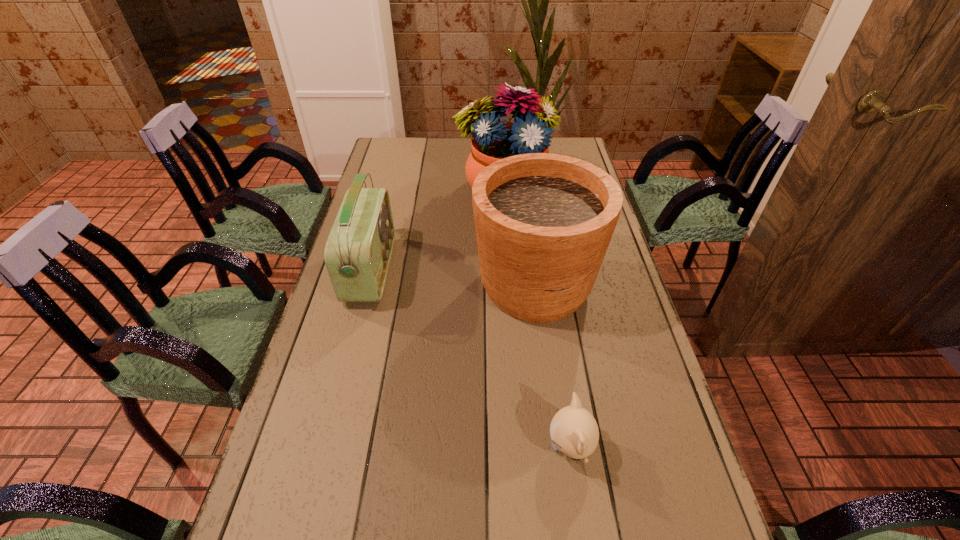
Image resolution: width=960 pixels, height=540 pixels. Find the location of `the tallest object`. the tallest object is located at coordinates (492, 140).

Where is `the farthest object`? This screenshot has width=960, height=540. the farthest object is located at coordinates (492, 140).

Identify the location of the third shortest object. (543, 222).

The image size is (960, 540). Find the location of `the leftmost object`. the leftmost object is located at coordinates (358, 250).

You are a GUI agent. You are given a task and a screenshot of the screen. Output one action in this format:
    pyautogui.click(x=<x>, y=<y>)
    Task: Click on the radio receiver
    The width and height of the screenshot is (960, 540).
    Given the screenshot: What is the action you would take?
    pyautogui.click(x=358, y=250)

Where is `the shortest object`? the shortest object is located at coordinates (574, 431).

Find the location of a particular element. Image resolution: width=960 pixels, height=540 pixels. kitten is located at coordinates (574, 431).

You are a GUI agent. You are given a task and a screenshot of the screen. Output one action in this format:
    pyautogui.click(x=<x>, y=<y>)
    Task: Click on the vacant region located 0.110m on the front of the farthest object
    This screenshot has height=540, width=960.
    Given the screenshot: What is the action you would take?
    pyautogui.click(x=508, y=237)

The width and height of the screenshot is (960, 540). Identify the location of free space located 0.330m on the back of the second tallest object. tap(523, 188).

Where is `vacant region located 0.080m on the front panel of the leftmost object`? vacant region located 0.080m on the front panel of the leftmost object is located at coordinates (418, 270).